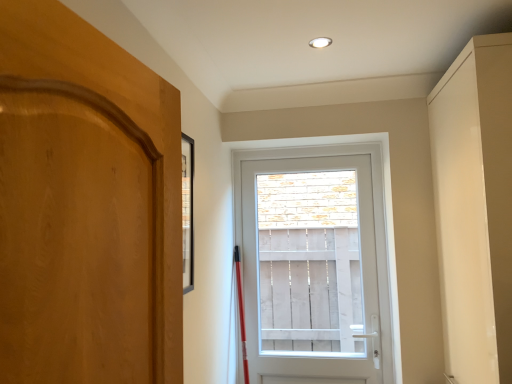
Identify the location of matte beige cabinet at right. (475, 208).

What do you see at coordinates (475, 208) in the screenshot?
I see `matte beige cabinet at right` at bounding box center [475, 208].

In order to face matte beige cabinet at right, should I rotate leftwards or rightwards?

To align with it, rotate right about 30.321°.

What do you see at coordinates (373, 196) in the screenshot?
I see `white plastic door at center` at bounding box center [373, 196].

Where is `white plastic door at center`? white plastic door at center is located at coordinates (373, 196).

Locate an element on the screen. The image size is (512, 384). matte beige cabinet at right is located at coordinates (475, 208).

Is matte beige cabinet at right to the left of white plastic door at center from the viewer's perspective?

No, matte beige cabinet at right is not to the left of white plastic door at center.

Considering their positions, is matte beige cabinet at right located in front of or behind white plastic door at center?

In the image, matte beige cabinet at right appears in front of white plastic door at center.

Is point (501, 164) closer or farther from the camera than point (329, 143)?

Point (501, 164) appears to be closer to the viewer than point (329, 143).

Based on the photo, from the image's perspective, between matte beige cabinet at right and white plastic door at center, who is located below?

white plastic door at center, from the image's perspective.

From a real-world perspective, who is located lower, matte beige cabinet at right or white plastic door at center?

In real-world perspective, white plastic door at center is lower.

Can you confirm if matte beige cabinet at right is wider than white plastic door at center?

Yes.

Between matte beige cabinet at right and white plastic door at center, which one has less height?

white plastic door at center is shorter.

Between matte beige cabinet at right and white plastic door at center, which one has smaller size?

white plastic door at center.

Is matte beige cabinet at right not within white plastic door at center?

Absolutely, matte beige cabinet at right is external to white plastic door at center.

Is matte beige cabinet at right beside white plastic door at center?

No, matte beige cabinet at right is not beside white plastic door at center.

Could you tell me if matte beige cabinet at right is turned towards white plastic door at center?

No, matte beige cabinet at right does not turn towards white plastic door at center.

What's the angular difference between matte beige cabinet at right and white plastic door at center's facing directions?

90.2 degrees.

I want to click on cabinetry that appears in front of the white plastic door at center, so click(475, 208).

Is white plastic door at center at the left side of matte beige cabinet at right?

Correct, you'll find white plastic door at center to the left of matte beige cabinet at right.

Considering the positions of objects white plastic door at center and matte beige cabinet at right in the image provided, who is in front, white plastic door at center or matte beige cabinet at right?

Positioned in front is matte beige cabinet at right.

Which is behind, point (273, 146) or point (510, 154)?

The point (273, 146) is behind.

From the image's perspective, who appears lower, white plastic door at center or matte beige cabinet at right?

From the image's view, white plastic door at center is below.

From the picture: From a real-world perspective, is white plastic door at center physically located above or below matte beige cabinet at right?

white plastic door at center is situated lower than matte beige cabinet at right in the real world.

Does white plastic door at center have a lesser width compared to matte beige cabinet at right?

Indeed, white plastic door at center has a lesser width compared to matte beige cabinet at right.

Is white plastic door at center shorter than matte beige cabinet at right?

Yes, white plastic door at center is shorter than matte beige cabinet at right.

Can you confirm if white plastic door at center is bigger than matte beige cabinet at right?

Incorrect, white plastic door at center is not larger than matte beige cabinet at right.

Is white plastic door at center spatially inside matte beige cabinet at right, or outside of it?

white plastic door at center is not inside matte beige cabinet at right, it's outside.

Would you consider white plastic door at center to be distant from matte beige cabinet at right?

No, white plastic door at center is not far from matte beige cabinet at right.

Is white plastic door at center turned away from matte beige cabinet at right?

white plastic door at center does not have its back to matte beige cabinet at right.

Where is `door below the matte beige cabinet at right (from a real-world perspective)`? This screenshot has width=512, height=384. door below the matte beige cabinet at right (from a real-world perspective) is located at coordinates (373, 196).

You are a GUI agent. You are given a task and a screenshot of the screen. Output one action in this format:
    pyautogui.click(x=<x>, y=<y>)
    Task: Click on the door behind the matte beige cabinet at right
    The width and height of the screenshot is (512, 384).
    Given the screenshot: What is the action you would take?
    pyautogui.click(x=373, y=196)

Where is `door directly beneath the matte beige cabinet at right (from a real-world perspective)`? door directly beneath the matte beige cabinet at right (from a real-world perspective) is located at coordinates (373, 196).